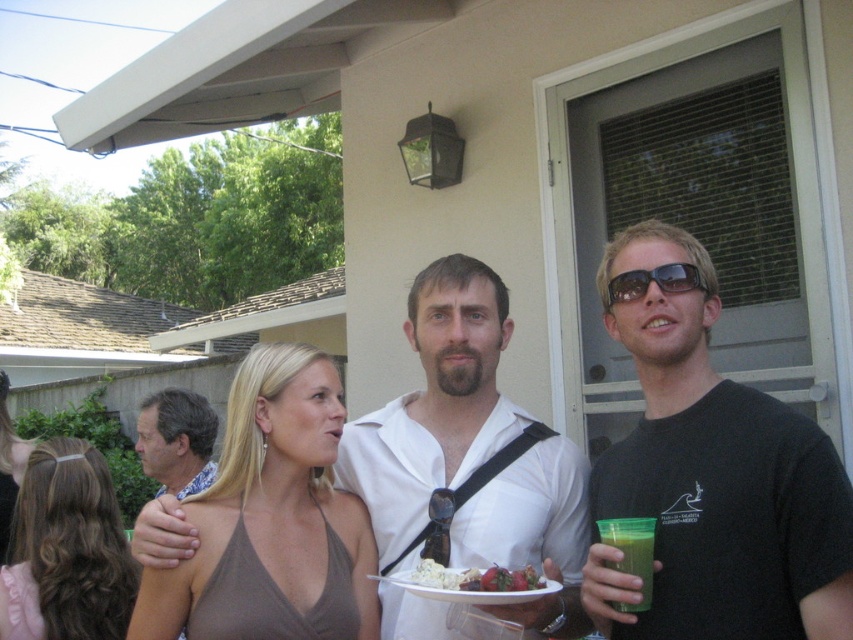
Question: Can you confirm if sunglasses at center is positioned to the right of white creamy salad at center?

Choices:
 (A) no
 (B) yes

Answer: (B)

Question: Is black matte t-shirt at center positioned behind white matte shirt at center?

Choices:
 (A) no
 (B) yes

Answer: (A)

Question: Does brown fabric dress at center come in front of sunglasses at center?

Choices:
 (A) yes
 (B) no

Answer: (B)

Question: Which of the following is the farthest from the observer?

Choices:
 (A) black matte t-shirt at center
 (B) brown hair at center
 (C) green translucent cup at right

Answer: (B)

Question: Among these points, which one is nearest to the camera?

Choices:
 (A) (426, 576)
 (B) (463, 576)
 (C) (180, 461)

Answer: (B)

Question: Which object appears farthest from the camera in this image?

Choices:
 (A) smooth white plate at center
 (B) black matte t-shirt at center
 (C) white creamy salad at center
 (D) brown hair at center

Answer: (D)